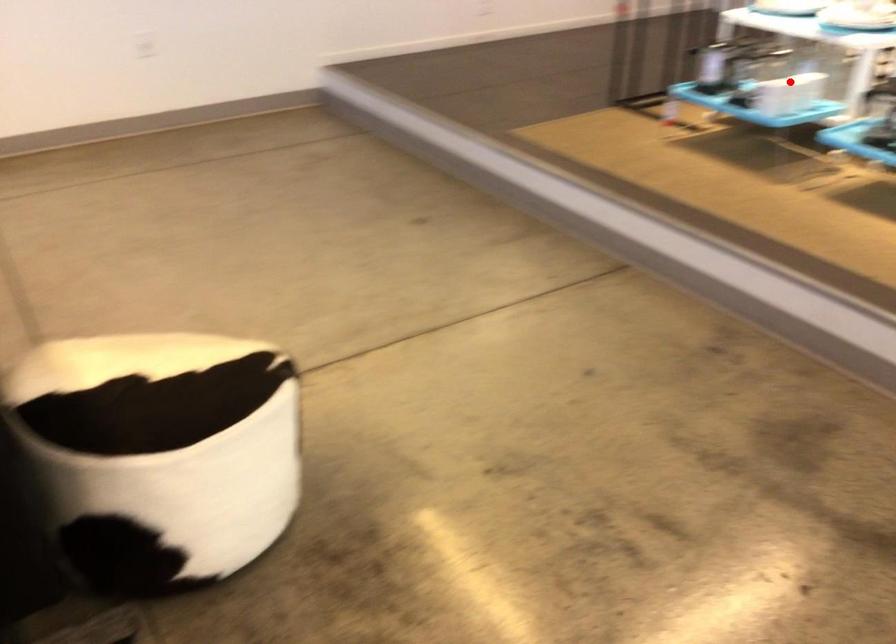
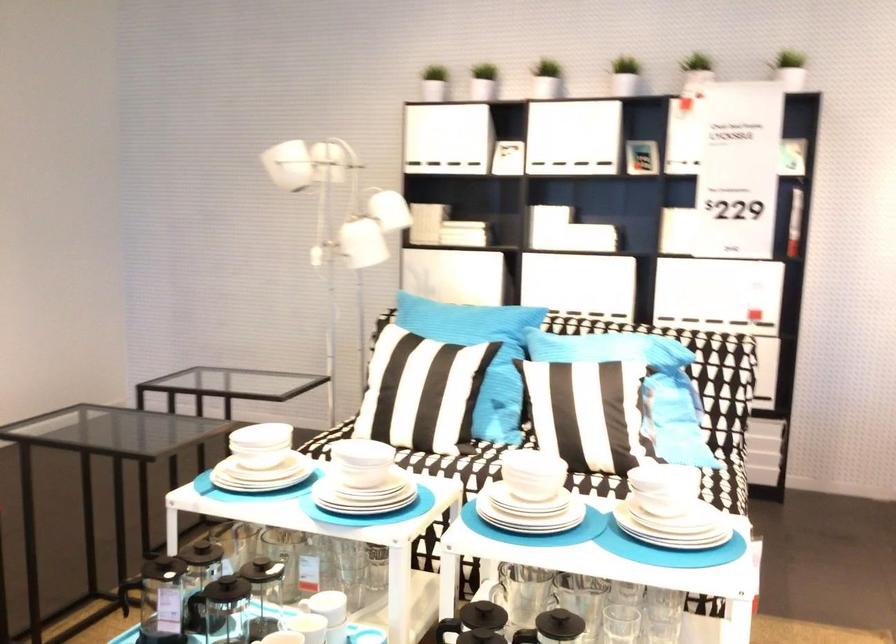
Find the pixel in the second image that matches the highlighted location in the first image.

(304, 629)